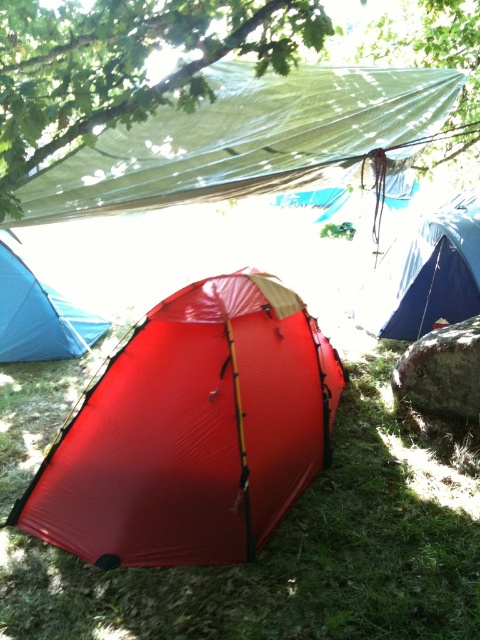
You are setting up a campsite and notice two red tents labeled shiny red tent at center and matte red tent at center. Which tent is closer to you based on their positions?

The shiny red tent at center is closer to you because it is in front of the matte red tent at center.

You are setting up a campsite and have two tarps available. You need to choose between the blue tarpaulin tent at right and the green matte tarp at upper center. Which one should you pick if you want to cover a larger area?

The green matte tarp at upper center occupies more space than the blue tarpaulin tent at right, so you should pick the green matte tarp at upper center to cover a larger area.